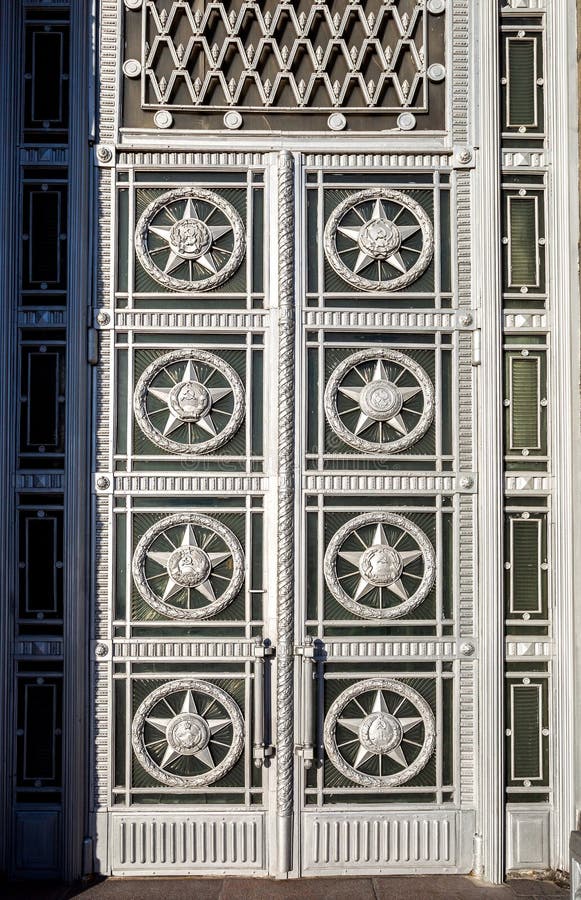
Find the location of a particular element. The height and width of the screenshot is (900, 581). the left door is located at coordinates (210, 830).